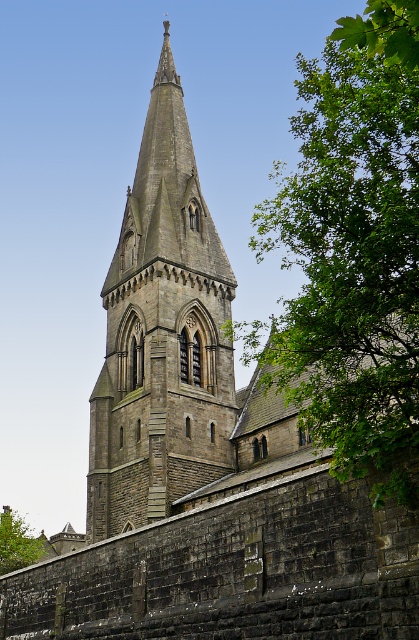
Is gray stone tower at center in front of green leafy tree at lower left?

Yes, it is.

In the scene shown: Who is more forward, [129,400] or [26,560]?

Positioned in front is point [129,400].

The height and width of the screenshot is (640, 419). Identify the location of gray stone tower at center. (162, 336).

Which of these two, green leafy tree at upper right or gray stone tower at center, stands shorter?

With less height is gray stone tower at center.

Which is below, green leafy tree at upper right or gray stone tower at center?

Answer: gray stone tower at center is lower down.

Who is more distant from viewer, (414, 266) or (196, 484)?

The point (196, 484) is more distant.

The width and height of the screenshot is (419, 640). What are the coordinates of `green leafy tree at upper right` in the screenshot? It's located at (351, 252).

Does green leafy tree at upper right appear over green leafy tree at lower left?

Correct, green leafy tree at upper right is located above green leafy tree at lower left.

Does green leafy tree at upper right have a smaller size compared to green leafy tree at lower left?

Actually, green leafy tree at upper right might be larger than green leafy tree at lower left.

Between point (328, 340) and point (18, 554), which one is positioned in front?

Point (328, 340)

Find the location of `green leafy tree at upper right`. green leafy tree at upper right is located at coordinates (351, 252).